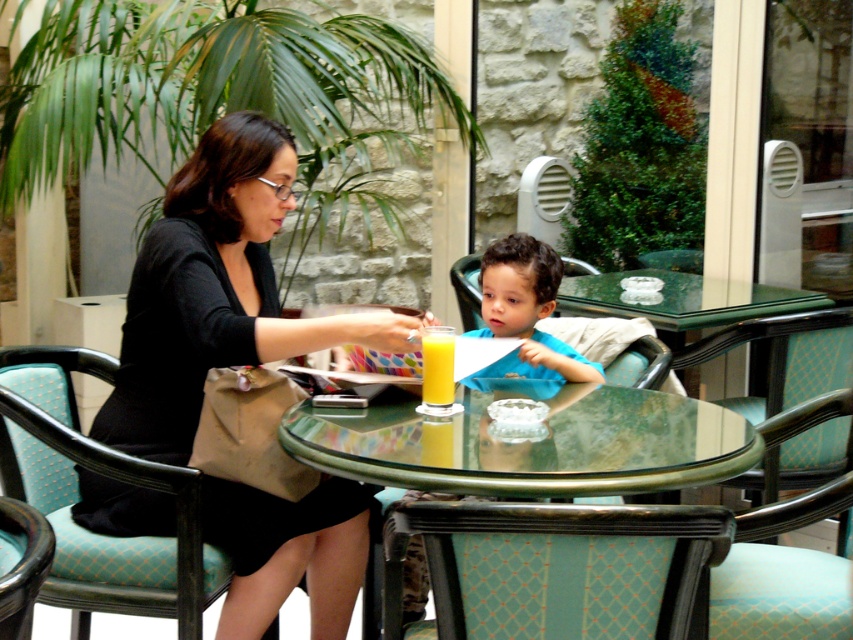
You are a customer entering the cafe and want to sit near the glass table at the center. There is a point marked at coordinates (215, 291). What object is located at that point?

The point at coordinates (215, 291) marks the location of the matte black dress at center.

You are a person who wants to sit down at the transparent glass table at center. There is a textured teal fabric chair at lower center nearby. Can you sit on the chair to reach the table?

The textured teal fabric chair at lower center is smaller than the transparent glass table at center, so it might be difficult to sit on the chair to reach the table comfortably.

You are standing at the camera position and want to pick up an object located at point (682, 545). The object is 1.76 meters away from you. If your maximum reach is 1.8 meters, can you reach it without moving?

The object located at point (682, 545) is 1.76 meters away from you, so yes, you can reach it since your maximum reach is 1.8 meters.